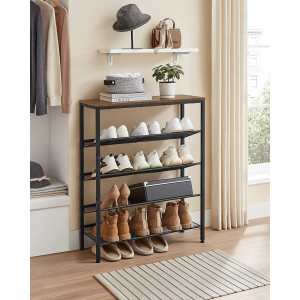
This screenshot has height=300, width=300. I want to click on slippers, so click(x=111, y=255), click(x=125, y=247), click(x=138, y=245), click(x=155, y=245).